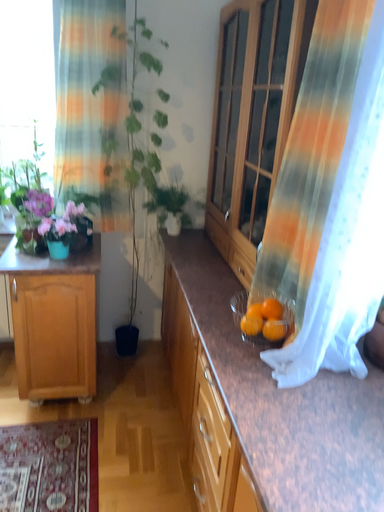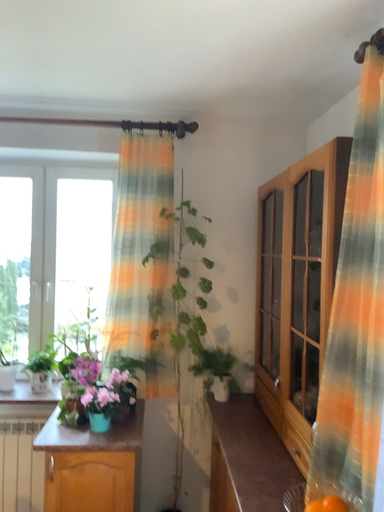
Question: How did the camera likely rotate when shooting the video?

Choices:
 (A) rotated left
 (B) rotated right

Answer: (A)